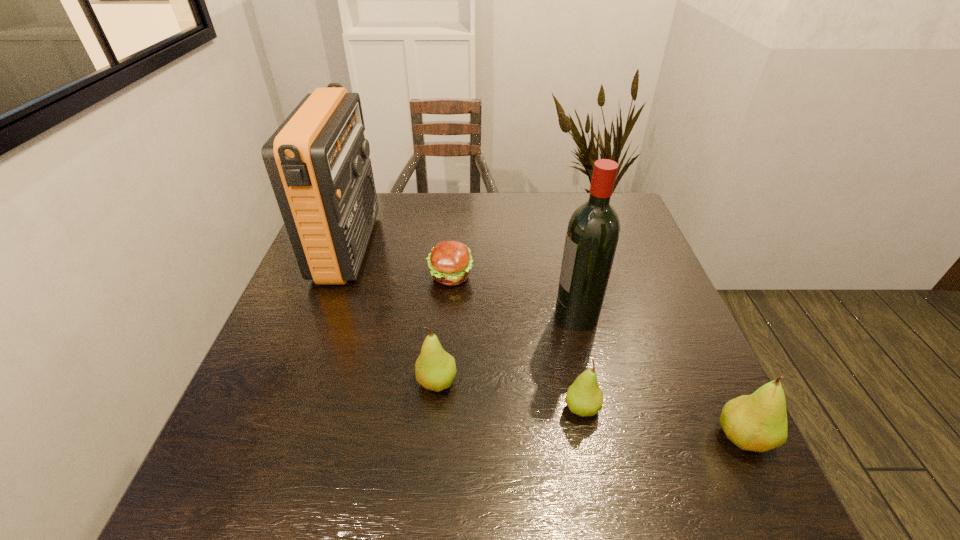
You are a GUI agent. You are given a task and a screenshot of the screen. Output one action in this format:
    pyautogui.click(x=<x>, y=<y>)
    Task: Click on the vacant space that is in between the shortest pear and the shortest object
    Image resolution: width=960 pixels, height=540 pixels.
    Given the screenshot: What is the action you would take?
    pyautogui.click(x=516, y=342)

Find the location of a particular element. The height and width of the screenshot is (540, 960). free space between the second shortest object and the rightmost pear is located at coordinates (661, 422).

This screenshot has width=960, height=540. Identify the location of free space that is in between the rightmost pear and the leftmost object. (544, 342).

Where is `blank region between the third shortest object and the radio receiver`? This screenshot has width=960, height=540. blank region between the third shortest object and the radio receiver is located at coordinates (393, 315).

Identify which object is located as the fourth nearest to the hamburger. Please provide its 2D coordinates. Your answer should be formatted as a tuple, i.e. [(x, y)], where the tuple contains the x and y coordinates of a point satisfying the conditions above.

[(584, 397)]

Find the location of `object that can be found as the fifth closest to the leftmost object`. object that can be found as the fifth closest to the leftmost object is located at coordinates (757, 422).

The image size is (960, 540). What are the coordinates of `the second closest pear to the fourth tallest object` in the screenshot? It's located at (757, 422).

Identify which pear is the second closest to the rightmost object. Please provide its 2D coordinates. Your answer should be formatted as a tuple, i.e. [(x, y)], where the tuple contains the x and y coordinates of a point satisfying the conditions above.

[(435, 369)]

Locate an element on the screen. The width and height of the screenshot is (960, 540). vacant region that satisfies the following two spatial constraints: 1. on the label of the third farthest object; 2. on the front side of the leftmost pear is located at coordinates (592, 382).

Find the location of `free spot that satisfies the following two spatial constraints: 1. on the back side of the hamburger; 2. on the front-facing side of the leftmost object`. free spot that satisfies the following two spatial constraints: 1. on the back side of the hamburger; 2. on the front-facing side of the leftmost object is located at coordinates (452, 247).